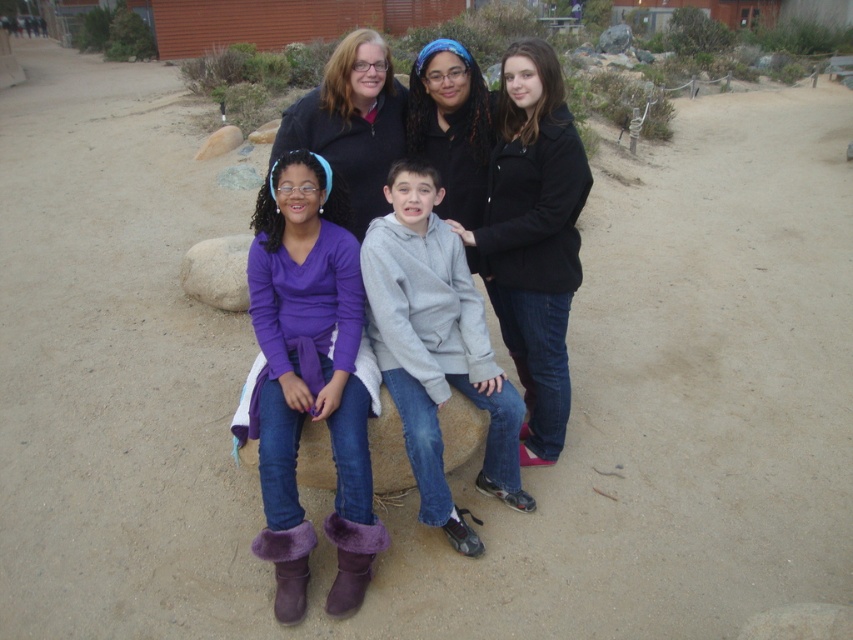
You are a photographer setting up a tripod to take a group photo of the gray fleece hoodie at center and the black matte jacket at upper right. The tripod has a height adjustment feature. Which of the two subjects should you adjust the tripod to be lower for to ensure both are framed properly?

The gray fleece hoodie at center has a lesser height compared to the black matte jacket at upper right, so you should adjust the tripod to be lower for the gray fleece hoodie at center to ensure proper framing.

You are a photographer trying to capture a clear photo of the purple fleece sweater at center. However, the black matte jacket at upper right is blocking your view. Can you move around to the left side of the jacket to get an unobstructed shot?

The purple fleece sweater at center is behind the black matte jacket at upper right, so moving to the left side of the black matte jacket at upper right might allow you to see around it and capture the purple fleece sweater at center without obstruction.